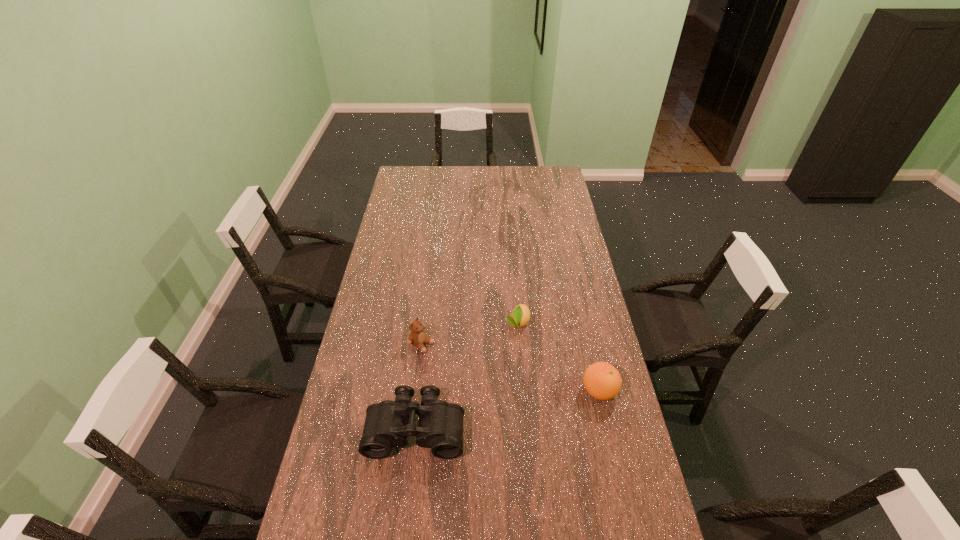
At what (x,y) coordinates should I click in order to perform the action: click on binoculars. Please return your answer as a coordinate pair (x, y). The image size is (960, 540). Looking at the image, I should click on (387, 425).

Where is `the rightmost object`? Image resolution: width=960 pixels, height=540 pixels. the rightmost object is located at coordinates (601, 380).

The width and height of the screenshot is (960, 540). Identify the location of teddy bear. (417, 337).

Identify the location of the third object from left to right. (520, 316).

Find the location of a particular element. The height and width of the screenshot is (540, 960). lemon is located at coordinates (520, 316).

Where is `blank space located 0.200m at the eyepieces of the binoculars`? Image resolution: width=960 pixels, height=540 pixels. blank space located 0.200m at the eyepieces of the binoculars is located at coordinates (404, 535).

Identify the location of vacant area located on the front of the orange. The width and height of the screenshot is (960, 540). (617, 469).

The height and width of the screenshot is (540, 960). I want to click on vacant space located on the front-facing side of the teddy bear, so click(465, 366).

Image resolution: width=960 pixels, height=540 pixels. Find the location of `vacant space located 0.340m on the front-facing side of the teddy bear`. vacant space located 0.340m on the front-facing side of the teddy bear is located at coordinates (516, 392).

At what (x,y) coordinates should I click in order to perform the action: click on vacant space located on the front-facing side of the teddy bear. Please return your answer as a coordinate pair (x, y). Image resolution: width=960 pixels, height=540 pixels. Looking at the image, I should click on (450, 359).